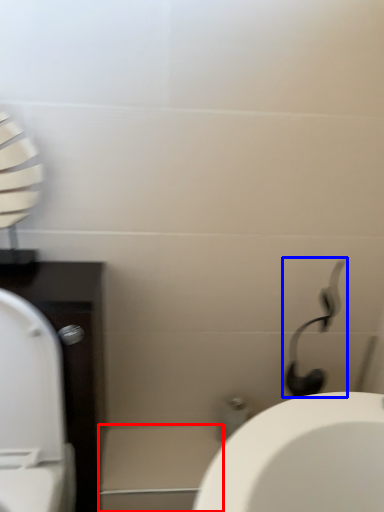
Question: Which point is closer to the camera, porcelain (highlighted by a red box) or shower (highlighted by a blue box)?

Choices:
 (A) porcelain
 (B) shower

Answer: (B)